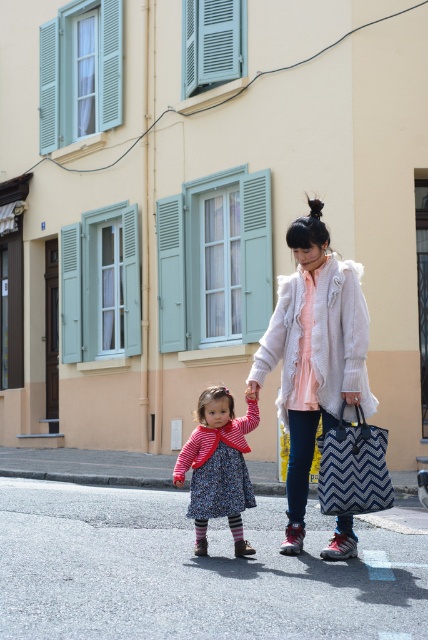
You are a delivery person who needs to choose a coat for a cold day. You see a white fluffy coat at center and a striped knit dress at center. Which one is bigger and more suitable for warmth?

The white fluffy coat at center is larger in size than the striped knit dress at center, so it is more suitable for warmth.